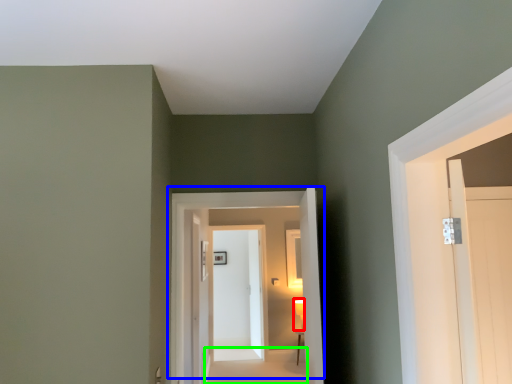
Question: Which is farther away from light fixture (highlighted by a red box)? door (highlighted by a blue box) or path (highlighted by a green box)?

Choices:
 (A) door
 (B) path

Answer: (A)